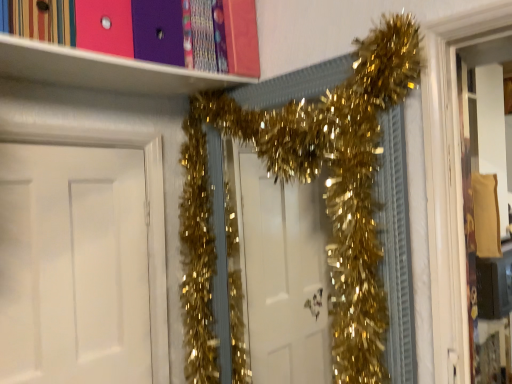
Question: Is point (10, 340) closer or farther from the camera than point (203, 94)?

Choices:
 (A) farther
 (B) closer

Answer: (B)

Question: Choose the correct answer: Is white matte door at left inside gold tinsel garland at center or outside it?

Choices:
 (A) outside
 (B) inside

Answer: (A)

Question: Considering the relative positions of white matte door at left and gold tinsel garland at center in the image provided, is white matte door at left to the left or to the right of gold tinsel garland at center?

Choices:
 (A) right
 (B) left

Answer: (B)

Question: From their relative heights in the image, would you say gold tinsel garland at center is taller or shorter than white matte door at left?

Choices:
 (A) tall
 (B) short

Answer: (A)

Question: Looking at their shapes, would you say gold tinsel garland at center is wider or thinner than white matte door at left?

Choices:
 (A) thin
 (B) wide

Answer: (B)

Question: Considering the positions of point (202, 324) and point (71, 369), is point (202, 324) closer or farther from the camera than point (71, 369)?

Choices:
 (A) closer
 (B) farther

Answer: (B)

Question: In the image, is gold tinsel garland at center positioned in front of or behind white matte door at left?

Choices:
 (A) front
 (B) behind

Answer: (A)